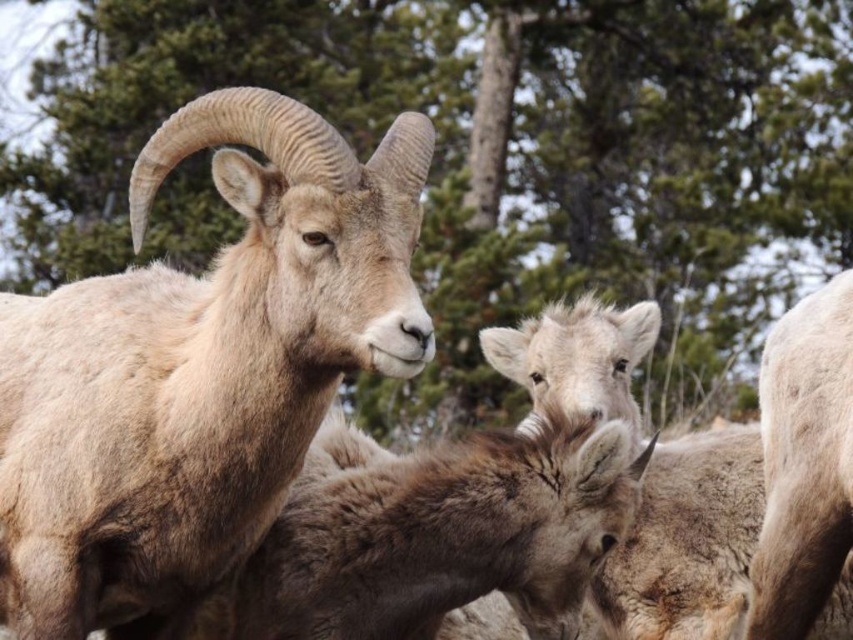
Who is more distant from viewer, (x=699, y=269) or (x=682, y=628)?

The point (x=699, y=269) is behind.

Can you confirm if green textured tree at upper center is wider than fuzzy beige sheep at center?

Indeed, green textured tree at upper center has a greater width compared to fuzzy beige sheep at center.

Which is behind, point (664, 156) or point (637, 516)?

Positioned behind is point (664, 156).

Identify the location of green textured tree at upper center. (485, 164).

Image resolution: width=853 pixels, height=640 pixels. Describe the element at coordinates (485, 164) in the screenshot. I see `green textured tree at upper center` at that location.

Between green textured tree at upper center and light brown woolly goat at left, which one is positioned lower?

light brown woolly goat at left is below.

Between point (254, 20) and point (229, 333), which one is positioned behind?

The point (254, 20) is behind.

What are the coordinates of `green textured tree at upper center` in the screenshot? It's located at (485, 164).

Between fuzzy beige sheep at center and fuzzy brown sheep at right, which one has less height?

fuzzy brown sheep at right

Does fuzzy beige sheep at center have a greater width compared to fuzzy brown sheep at right?

Indeed, fuzzy beige sheep at center has a greater width compared to fuzzy brown sheep at right.

What do you see at coordinates (688, 541) in the screenshot? I see `fuzzy beige sheep at center` at bounding box center [688, 541].

Find the location of a particular element. The height and width of the screenshot is (640, 853). fuzzy beige sheep at center is located at coordinates (688, 541).